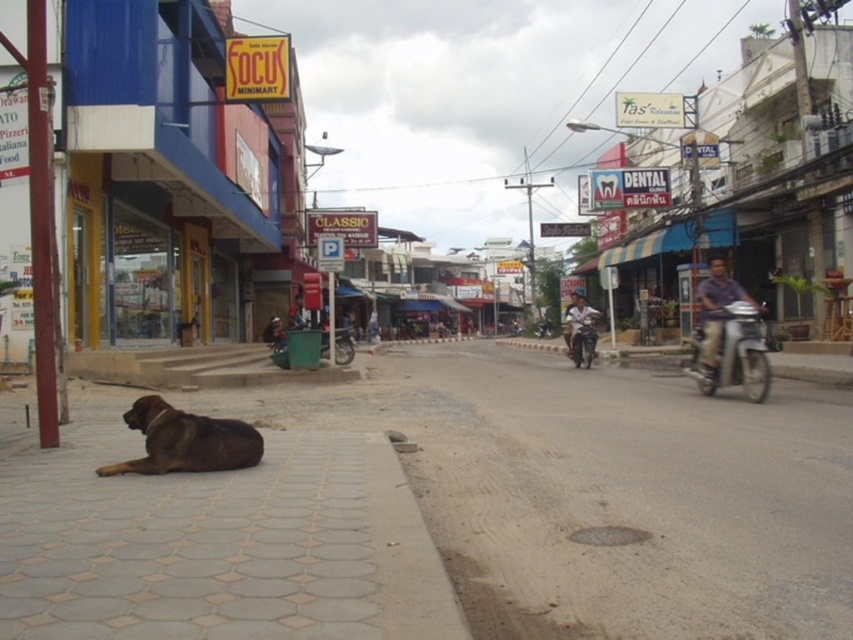
Which is more to the right, brown furry dog at lower left or metallic silver scooter at right?

metallic silver scooter at right

Between point (235, 422) and point (733, 355), which one is positioned in front?

Point (235, 422)

At what (x,y) coordinates should I click in order to perform the action: click on brown furry dog at lower left. Please return your answer as a coordinate pair (x, y). This screenshot has width=853, height=640. Looking at the image, I should click on (184, 440).

Does brown paving stone at lower left appear under brown stone pavement at lower left?

Indeed, brown paving stone at lower left is positioned under brown stone pavement at lower left.

Locate an element on the screen. The image size is (853, 640). brown paving stone at lower left is located at coordinates (606, 492).

Can you confirm if brown stone pavement at lower left is bigger than metallic silver scooter at right?

No, brown stone pavement at lower left is not bigger than metallic silver scooter at right.

Is point (300, 449) behind point (755, 365)?

That is False.

Measure the distance between point (x=3, y=458) and camera.

Point (x=3, y=458) is 5.71 meters from camera.

This screenshot has width=853, height=640. I want to click on brown stone pavement at lower left, so click(x=213, y=540).